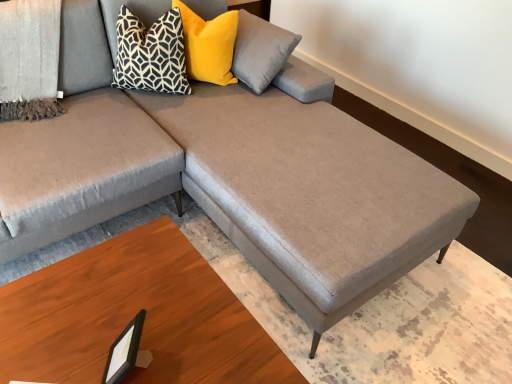
Question: Would you say black plastic picture frame at lower left is inside or outside black geometric-patterned pillow at upper left, the 1th pillow in the left-to-right sequence?

Choices:
 (A) inside
 (B) outside

Answer: (B)

Question: Is black plastic picture frame at lower left in front of or behind black geometric-patterned pillow at upper left, arranged as the 2th pillow when viewed from the right, in the image?

Choices:
 (A) behind
 (B) front

Answer: (B)

Question: Which object is the farthest from the black plastic picture frame at lower left?

Choices:
 (A) yellow velvet pillow at upper center, acting as the first pillow starting from the right
 (B) black geometric-patterned pillow at upper left, the 1th pillow in the left-to-right sequence
 (C) textured gray blanket at upper left
 (D) wooden table at lower right

Answer: (A)

Question: Based on their relative distances, which object is nearer to the yellow velvet pillow at upper center, acting as the first pillow starting from the right?

Choices:
 (A) black geometric-patterned pillow at upper left, the 1th pillow in the left-to-right sequence
 (B) black plastic picture frame at lower left
 (C) textured gray blanket at upper left
 (D) wooden table at lower right

Answer: (A)